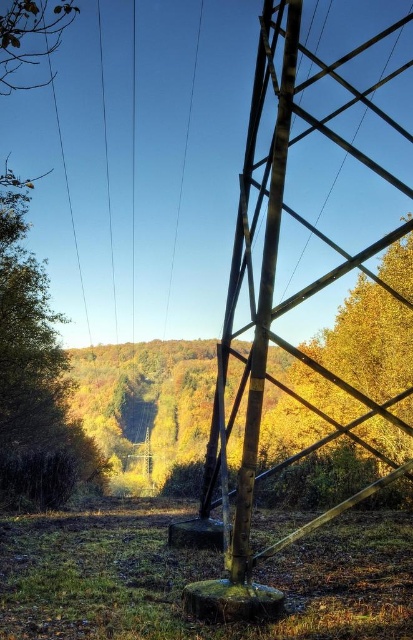
You are standing in front of the large metallic electrical pylon and notice two points marked on the ground. The first point is at coordinates point (x=2, y=547) and the second is at point (x=18, y=346). Which of these two points is closer to you?

Point (x=2, y=547) is in front of point (x=18, y=346), so it is closer to you.

You are a photographer standing at a certain distance from the green mossy stump at center. You want to take a closeup shot of it without moving the camera. What should you do?

You should zoom in on the green mossy stump at center since it is 4.23 meters away from the camera, which requires adjusting the camera lens to capture a closer view without physically moving closer.